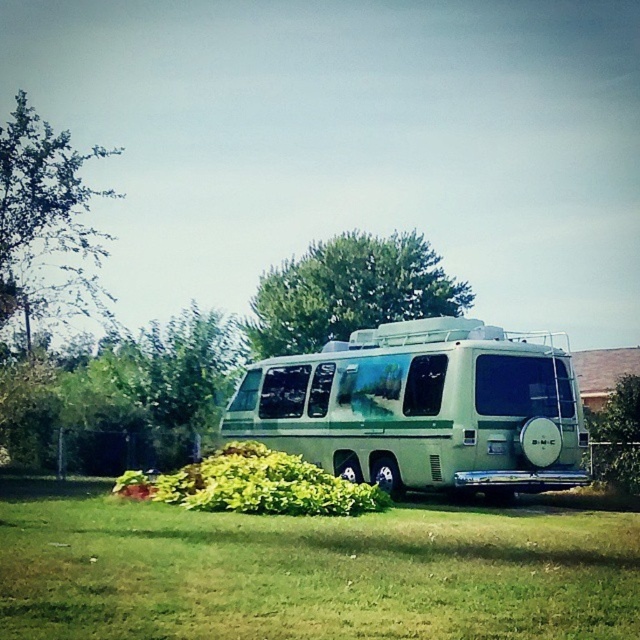
Question: Can you confirm if green grass at center is positioned above green leafy tree at upper left?

Choices:
 (A) yes
 (B) no

Answer: (B)

Question: Among these objects, which one is farthest from the camera?

Choices:
 (A) green matte van at center
 (B) green leafy tree at upper center
 (C) green leafy tree at upper left

Answer: (B)

Question: Which object appears closest to the camera in this image?

Choices:
 (A) green matte van at center
 (B) green leafy tree at upper left
 (C) green grass at center

Answer: (C)

Question: Which point is farther from the camera taking this photo?

Choices:
 (A) (506, 435)
 (B) (77, 154)
 (C) (163, 588)

Answer: (B)

Question: Observing the image, what is the correct spatial positioning of green grass at center in reference to green leafy tree at upper left?

Choices:
 (A) left
 (B) right

Answer: (B)

Question: Does green leafy tree at upper center appear on the left side of green leafy tree at upper left?

Choices:
 (A) no
 (B) yes

Answer: (A)